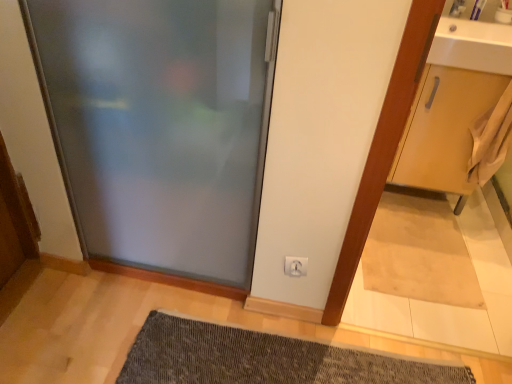
The width and height of the screenshot is (512, 384). Identify the location of vacant region under light brown wood cabinet at right (from a real-world perspective). (421, 208).